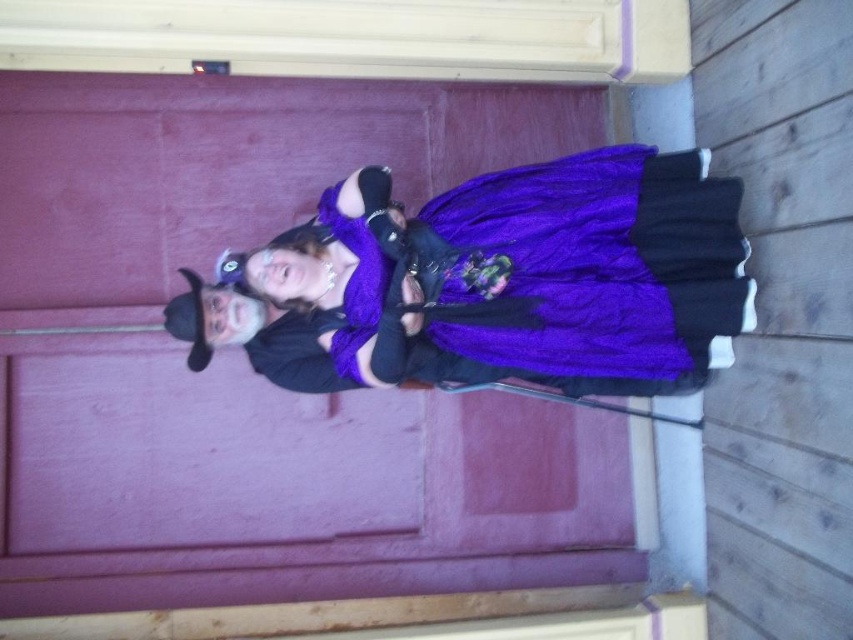
Is point (364, 106) behind point (318, 296)?

Yes, it is behind point (318, 296).

Describe the element at coordinates (286, 484) in the screenshot. I see `purple matte door at center` at that location.

You are a GUI agent. You are given a task and a screenshot of the screen. Output one action in this format:
    pyautogui.click(x=<x>, y=<y>)
    Task: Click on the purple matte door at center
    
    Given the screenshot: What is the action you would take?
    pyautogui.click(x=286, y=484)